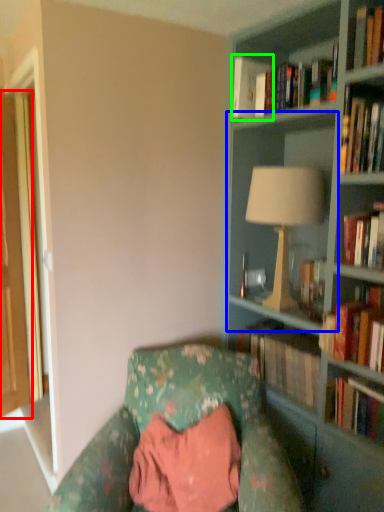
Question: Which is nearer to the glass door (highlighted by a red box)? shelf (highlighted by a blue box) or book (highlighted by a green box).

Choices:
 (A) shelf
 (B) book

Answer: (B)